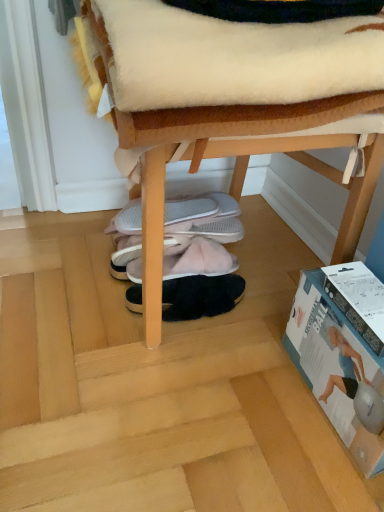
Based on the photo, measure the distance between black fuzzy slippers at center, the first footwear ordered from the bottom, and camera.

They are 35.25 inches apart.

What is the approximate width of pink fuzzy slippers at center, which ranks as the second footwear in top-to-bottom order?

pink fuzzy slippers at center, which ranks as the second footwear in top-to-bottom order, is 11.07 inches in width.

Locate an element on the screen. This screenshot has height=512, width=384. wooden chair at center is located at coordinates coord(220,156).

Identify the location of white fabric slippers at center, which is the third footwear from bottom to top. point(198,211).

From the image's perspective, who appears lower, white fabric slippers at center, which is the third footwear from bottom to top, or black fuzzy slippers at center, which appears as the third footwear when viewed from the top?

From the image's view, black fuzzy slippers at center, which appears as the third footwear when viewed from the top, is below.

How much distance is there between white fabric slippers at center, the first footwear viewed from the top, and black fuzzy slippers at center, the first footwear ordered from the bottom?

The distance of white fabric slippers at center, the first footwear viewed from the top, from black fuzzy slippers at center, the first footwear ordered from the bottom, is 6.58 inches.

Which is closer to the camera, [123,230] or [222,281]?

The point [222,281] is closer to the camera.

Which object is positioned more to the right, white fabric slippers at center, the first footwear viewed from the top, or black fuzzy slippers at center, the first footwear ordered from the bottom?

black fuzzy slippers at center, the first footwear ordered from the bottom, is more to the right.

How many degrees apart are the facing directions of wooden chair at center and white cardboard box at lower right?

They differ by 90.9 degrees in their facing directions.

Which object is thinner, wooden chair at center or white cardboard box at lower right?

white cardboard box at lower right.

Is wooden chair at center behind white cardboard box at lower right?

No, wooden chair at center is in front of white cardboard box at lower right.

This screenshot has height=512, width=384. In order to click on furniture above the white cardboard box at lower right (from a real-world perspective) in this screenshot , I will do `click(220, 156)`.

Is white fabric slippers at center, which is the third footwear from bottom to top, thinner than white cardboard box at lower right?

In fact, white fabric slippers at center, which is the third footwear from bottom to top, might be wider than white cardboard box at lower right.

Can you tell me how much white fabric slippers at center, the first footwear viewed from the top, and white cardboard box at lower right differ in facing direction?

They differ by 0.864 degrees in their facing directions.

Is white fabric slippers at center, which is the third footwear from bottom to top, facing away from white cardboard box at lower right?

white fabric slippers at center, which is the third footwear from bottom to top, does not have its back to white cardboard box at lower right.

Is white fabric slippers at center, the first footwear viewed from the top, taller than white cardboard box at lower right?

No.

From the image's perspective, which object appears higher, wooden chair at center or white fabric slippers at center, which is the third footwear from bottom to top?

wooden chair at center.

Would you say wooden chair at center is outside white fabric slippers at center, the first footwear viewed from the top?

Yes, wooden chair at center is located beyond the bounds of white fabric slippers at center, the first footwear viewed from the top.

Is wooden chair at center bigger or smaller than white fabric slippers at center, which is the third footwear from bottom to top?

Clearly, wooden chair at center is larger in size than white fabric slippers at center, which is the third footwear from bottom to top.

Which is closer, (x=371, y=26) or (x=168, y=204)?

Point (x=371, y=26) appears to be closer to the viewer than point (x=168, y=204).

Based on the photo, what's the angular difference between pink fuzzy slippers at center, the second footwear ordered from the bottom, and white fabric slippers at center, the first footwear viewed from the top,'s facing directions?

They differ by 0.58 degrees in their facing directions.

Who is shorter, pink fuzzy slippers at center, the second footwear ordered from the bottom, or white fabric slippers at center, the first footwear viewed from the top?

white fabric slippers at center, the first footwear viewed from the top.

Considering the points (173, 266) and (219, 210), which point is behind, point (173, 266) or point (219, 210)?

The point (219, 210) is behind.

Which object is further away from the camera taking this photo, pink fuzzy slippers at center, which ranks as the second footwear in top-to-bottom order, or white fabric slippers at center, which is the third footwear from bottom to top?

Positioned behind is white fabric slippers at center, which is the third footwear from bottom to top.

Looking at this image, would you say wooden chair at center contains pink fuzzy slippers at center, the second footwear ordered from the bottom?

Yes, wooden chair at center is surrounding pink fuzzy slippers at center, the second footwear ordered from the bottom.

Which object is closer to the camera taking this photo, wooden chair at center or pink fuzzy slippers at center, which ranks as the second footwear in top-to-bottom order?

wooden chair at center.

Is wooden chair at center next to pink fuzzy slippers at center, which ranks as the second footwear in top-to-bottom order?

wooden chair at center and pink fuzzy slippers at center, which ranks as the second footwear in top-to-bottom order, are clearly separated.

Considering the sizes of objects wooden chair at center and pink fuzzy slippers at center, the second footwear ordered from the bottom, in the image provided, who is shorter, wooden chair at center or pink fuzzy slippers at center, the second footwear ordered from the bottom,?

pink fuzzy slippers at center, the second footwear ordered from the bottom.

Based on their positions, is black fuzzy slippers at center, which appears as the third footwear when viewed from the top, located to the left or right of white cardboard box at lower right?

Based on their positions, black fuzzy slippers at center, which appears as the third footwear when viewed from the top, is located to the left of white cardboard box at lower right.

Does black fuzzy slippers at center, which appears as the third footwear when viewed from the top, touch white cardboard box at lower right?

No, black fuzzy slippers at center, which appears as the third footwear when viewed from the top, is not making contact with white cardboard box at lower right.

Based on the photo, is black fuzzy slippers at center, which appears as the third footwear when viewed from the top, behind white cardboard box at lower right?

Yes, black fuzzy slippers at center, which appears as the third footwear when viewed from the top, is behind white cardboard box at lower right.

Starting from the black fuzzy slippers at center, which appears as the third footwear when viewed from the top, which footwear is the 2nd one to the left? Please provide its 2D coordinates.

[(198, 211)]

Identify the location of furniture in front of the white cardboard box at lower right. The image size is (384, 512). (220, 156).

Based on the photo, from the image, which object appears to be nearer to wooden chair at center, black fuzzy slippers at center, which appears as the third footwear when viewed from the top, or white cardboard box at lower right?

white cardboard box at lower right.

Looking at the image, which one is located closer to pink fuzzy slippers at center, which ranks as the second footwear in top-to-bottom order, wooden chair at center or black fuzzy slippers at center, which appears as the third footwear when viewed from the top?

Based on the image, black fuzzy slippers at center, which appears as the third footwear when viewed from the top, appears to be nearer to pink fuzzy slippers at center, which ranks as the second footwear in top-to-bottom order.

Based on their spatial positions, is pink fuzzy slippers at center, the second footwear ordered from the bottom, or white fabric slippers at center, the first footwear viewed from the top, further from black fuzzy slippers at center, the first footwear ordered from the bottom?

white fabric slippers at center, the first footwear viewed from the top, is further to black fuzzy slippers at center, the first footwear ordered from the bottom.

Looking at the image, which one is located further to white cardboard box at lower right, wooden chair at center or black fuzzy slippers at center, which appears as the third footwear when viewed from the top?

black fuzzy slippers at center, which appears as the third footwear when viewed from the top, lies further to white cardboard box at lower right than the other object.

Looking at the image, which one is located further to white cardboard box at lower right, white fabric slippers at center, the first footwear viewed from the top, or pink fuzzy slippers at center, which ranks as the second footwear in top-to-bottom order?

Based on the image, white fabric slippers at center, the first footwear viewed from the top, appears to be further to white cardboard box at lower right.

When comparing their distances from white cardboard box at lower right, does black fuzzy slippers at center, the first footwear ordered from the bottom, or wooden chair at center seem further?

The object further to white cardboard box at lower right is black fuzzy slippers at center, the first footwear ordered from the bottom.

Estimate the real-world distances between objects in this image. Which object is further from white cardboard box at lower right, black fuzzy slippers at center, which appears as the third footwear when viewed from the top, or pink fuzzy slippers at center, the second footwear ordered from the bottom?

Among the two, pink fuzzy slippers at center, the second footwear ordered from the bottom, is located further to white cardboard box at lower right.

Estimate the real-world distances between objects in this image. Which object is further from black fuzzy slippers at center, the first footwear ordered from the bottom, white fabric slippers at center, which is the third footwear from bottom to top, or wooden chair at center?

wooden chair at center lies further to black fuzzy slippers at center, the first footwear ordered from the bottom, than the other object.

Locate an element on the screen. This screenshot has width=384, height=512. footwear between white fabric slippers at center, which is the third footwear from bottom to top, and black fuzzy slippers at center, which appears as the third footwear when viewed from the top, in the up-down direction is located at coordinates (200, 261).

At what (x,y) coordinates should I click in order to perform the action: click on footwear between wooden chair at center and pink fuzzy slippers at center, which ranks as the second footwear in top-to-bottom order, in the front-back direction. Please return your answer as a coordinate pair (x, y). This screenshot has height=512, width=384. Looking at the image, I should click on (200, 296).

Identify the location of footwear between white cardboard box at lower right and pink fuzzy slippers at center, which ranks as the second footwear in top-to-bottom order, in the front-back direction. The height and width of the screenshot is (512, 384). (200, 296).

The width and height of the screenshot is (384, 512). In order to click on paperback book between wooden chair at center and pink fuzzy slippers at center, which ranks as the second footwear in top-to-bottom order, in the front-back direction in this screenshot , I will do `click(338, 370)`.